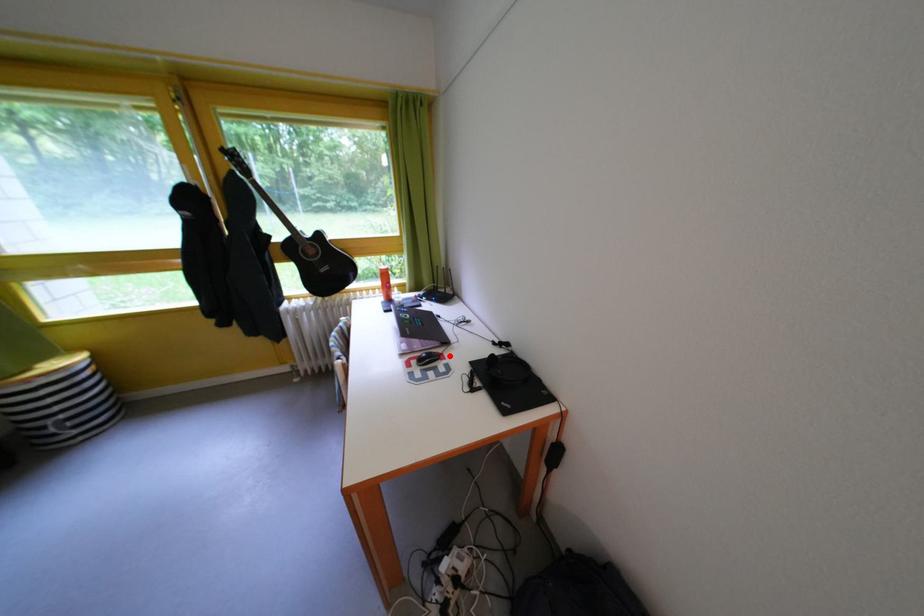
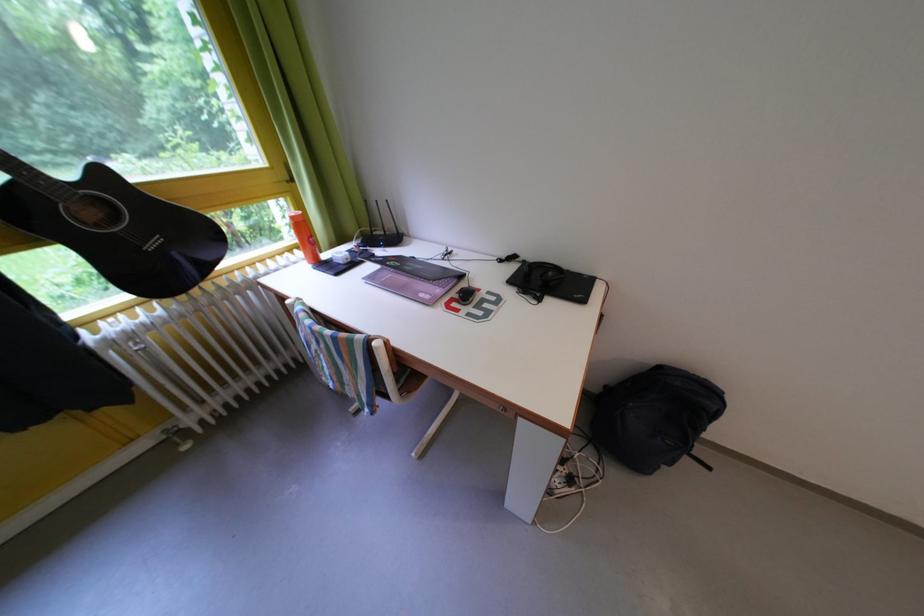
In the second image, find the point that corresponds to the highlighted location in the first image.

(473, 291)